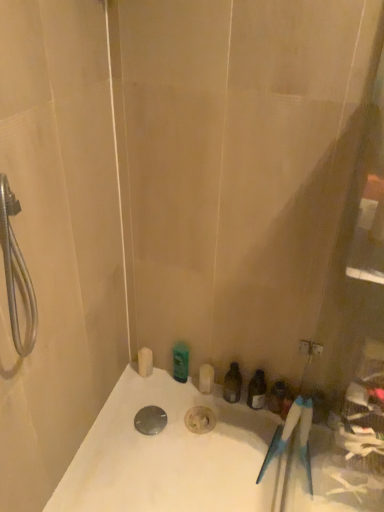
Identify the location of free space in front of translucent plastic bottle at center, which is the second toiletry in right-to-left order. The width and height of the screenshot is (384, 512). (229, 440).